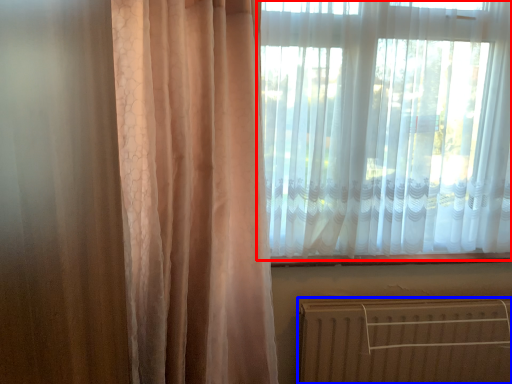
Question: Which of the following is the closest to the observer, curtain (highlighted by a red box) or radiator (highlighted by a blue box)?

Choices:
 (A) curtain
 (B) radiator

Answer: (A)